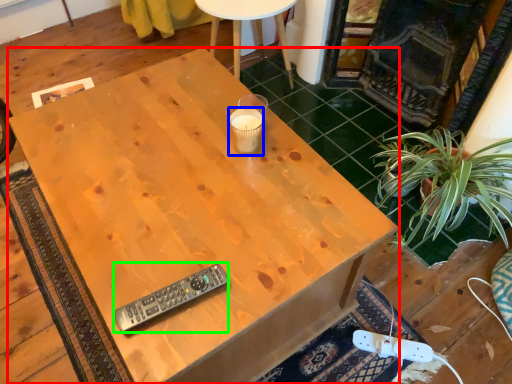
Question: Estimate the real-world distances between objects in this image. Which object is farther from desk (highlighted by a red box), coffee cup (highlighted by a blue box) or remote control (highlighted by a green box)?

Choices:
 (A) coffee cup
 (B) remote control

Answer: (B)